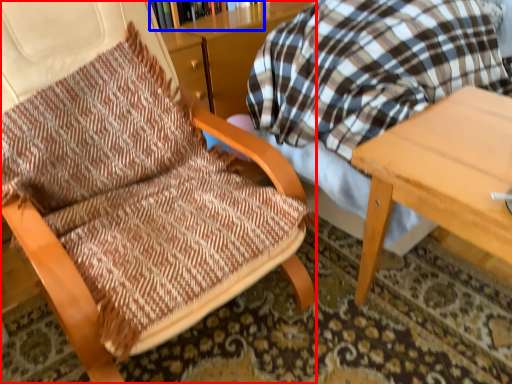
Question: Which object is further to the camera taking this photo, chair (highlighted by a red box) or bookcase (highlighted by a blue box)?

Choices:
 (A) chair
 (B) bookcase

Answer: (B)